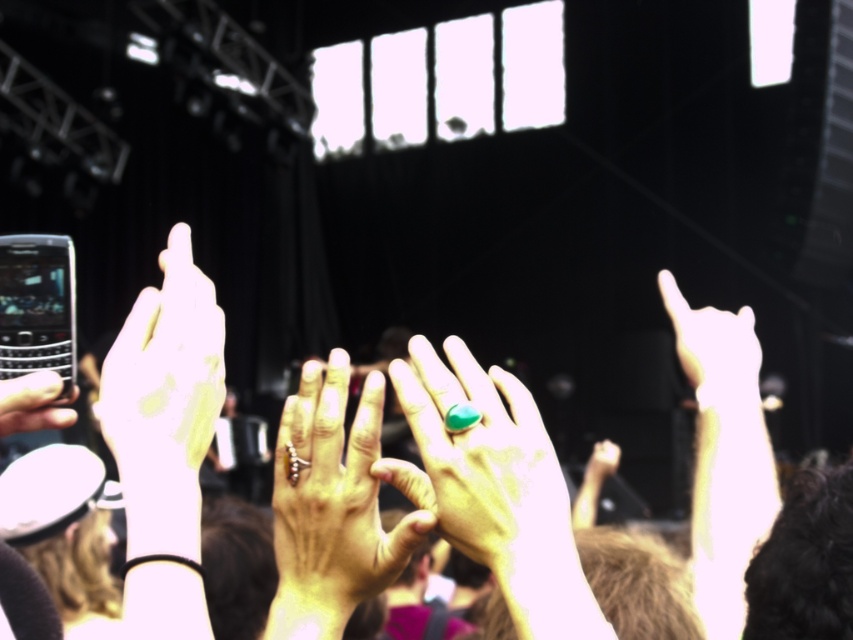
Is yellow matte ring at left positioned before silver metallic ring at center?

Yes, it is.

Can you confirm if yellow matte ring at left is positioned below silver metallic ring at center?

Incorrect, yellow matte ring at left is not positioned below silver metallic ring at center.

Does point (193, 419) lie in front of point (283, 540)?

Yes, it is.

Image resolution: width=853 pixels, height=640 pixels. Identify the location of yellow matte ring at left. (164, 376).

Does point (428, 387) lie in front of point (70, 420)?

That is True.

Between emerald green stone ring at center and black glossy phone at left, which one is positioned lower?

emerald green stone ring at center

Who is more distant from viewer, (x=515, y=481) or (x=0, y=435)?

Positioned behind is point (x=0, y=435).

The width and height of the screenshot is (853, 640). Find the location of `emerald green stone ring at center`. emerald green stone ring at center is located at coordinates (489, 467).

Does emerald green stone ring at center appear over yellow matte ring at left?

No.

Does emerald green stone ring at center lie behind yellow matte ring at left?

Yes, emerald green stone ring at center is behind yellow matte ring at left.

The height and width of the screenshot is (640, 853). What do you see at coordinates (489, 467) in the screenshot?
I see `emerald green stone ring at center` at bounding box center [489, 467].

Find the location of a particular element. emerald green stone ring at center is located at coordinates (489, 467).